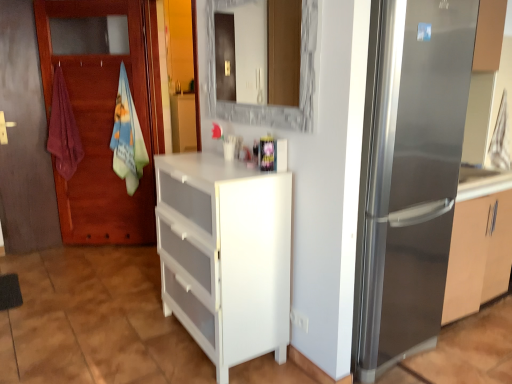
What do you see at coordinates (409, 175) in the screenshot?
I see `satin silver refrigerator at right` at bounding box center [409, 175].

Find the location of a particular element. This screenshot has width=512, height=384. light blue cotton beach towel at left, the second beach towel in the left-to-right sequence is located at coordinates (127, 137).

Describe the element at coordinates (63, 130) in the screenshot. I see `maroon cotton towel at left, positioned as the second beach towel in right-to-left order` at that location.

In order to click on wooden door at left in this screenshot , I will do `click(105, 122)`.

Where is `satin silver refrigerator at right`? satin silver refrigerator at right is located at coordinates (409, 175).

Is the depth of wooden door at left greater than that of satin silver refrigerator at right?

Yes, it is behind satin silver refrigerator at right.

Considering the sizes of wooden door at left and satin silver refrigerator at right in the image, is wooden door at left taller or shorter than satin silver refrigerator at right?

Considering their sizes, wooden door at left has more height than satin silver refrigerator at right.

Does point (102, 139) appear closer or farther from the camera than point (455, 181)?

Point (102, 139).

How much distance is there between wooden door at left and satin silver refrigerator at right?

They are 7.65 feet apart.

From the image's perspective, between light blue cotton beach towel at left, the second beach towel in the left-to-right sequence, and white plastic chest of drawers at center, which one is located above?

light blue cotton beach towel at left, the second beach towel in the left-to-right sequence, is shown above in the image.

Looking at their sizes, would you say light blue cotton beach towel at left, the second beach towel in the left-to-right sequence, is wider or thinner than white plastic chest of drawers at center?

Considering their sizes, light blue cotton beach towel at left, the second beach towel in the left-to-right sequence, looks slimmer than white plastic chest of drawers at center.

Do you think light blue cotton beach towel at left, which is counted as the 1th beach towel, starting from the right, is within white plastic chest of drawers at center, or outside of it?

A: light blue cotton beach towel at left, which is counted as the 1th beach towel, starting from the right, is located beyond the bounds of white plastic chest of drawers at center.

Is light blue cotton beach towel at left, the second beach towel in the left-to-right sequence, shorter than white plastic chest of drawers at center?

No, light blue cotton beach towel at left, the second beach towel in the left-to-right sequence, is not shorter than white plastic chest of drawers at center.

Is light blue cotton beach towel at left, which is counted as the 1th beach towel, starting from the right, wider or thinner than wooden door at left?

In the image, light blue cotton beach towel at left, which is counted as the 1th beach towel, starting from the right, appears to be wider than wooden door at left.

Considering the relative sizes of light blue cotton beach towel at left, which is counted as the 1th beach towel, starting from the right, and wooden door at left in the image provided, is light blue cotton beach towel at left, which is counted as the 1th beach towel, starting from the right, taller than wooden door at left?

Incorrect, the height of light blue cotton beach towel at left, which is counted as the 1th beach towel, starting from the right, is not larger of that of wooden door at left.

Considering the positions of objects light blue cotton beach towel at left, the second beach towel in the left-to-right sequence, and wooden door at left in the image provided, who is more to the left, light blue cotton beach towel at left, the second beach towel in the left-to-right sequence, or wooden door at left?

Positioned to the left is wooden door at left.

You are a GUI agent. You are given a task and a screenshot of the screen. Output one action in this format:
    pyautogui.click(x=<x>, y=<y>)
    Task: Click on the door above the maroon cotton towel at left, positioned as the first beach towel in left-to-right order (from a real-world perspective)
    This screenshot has width=512, height=384.
    Given the screenshot: What is the action you would take?
    pyautogui.click(x=105, y=122)

Based on the photo, does wooden door at left turn towards maroon cotton towel at left, positioned as the first beach towel in left-to-right order?

Yes, wooden door at left is oriented towards maroon cotton towel at left, positioned as the first beach towel in left-to-right order.

Consider the image. From a real-world perspective, which is physically above, wooden door at left or maroon cotton towel at left, positioned as the second beach towel in right-to-left order?

In real-world perspective, wooden door at left is above.

Can you confirm if wooden door at left is thinner than maroon cotton towel at left, positioned as the first beach towel in left-to-right order?

Yes, wooden door at left is thinner than maroon cotton towel at left, positioned as the first beach towel in left-to-right order.

From a real-world perspective, between wooden door at left and white plastic chest of drawers at center, who is vertically higher?

wooden door at left is physically above.

Looking at the image, does wooden door at left seem bigger or smaller compared to white plastic chest of drawers at center?

Considering their sizes, wooden door at left takes up less space than white plastic chest of drawers at center.

Considering the relative positions of wooden door at left and white plastic chest of drawers at center in the image provided, is wooden door at left to the left or to the right of white plastic chest of drawers at center?

wooden door at left is to the left of white plastic chest of drawers at center.

Based on the photo, considering the sizes of objects light blue cotton beach towel at left, the second beach towel in the left-to-right sequence, and maroon cotton towel at left, positioned as the second beach towel in right-to-left order, in the image provided, who is thinner, light blue cotton beach towel at left, the second beach towel in the left-to-right sequence, or maroon cotton towel at left, positioned as the second beach towel in right-to-left order,?

With smaller width is maroon cotton towel at left, positioned as the second beach towel in right-to-left order.

What's the angular difference between light blue cotton beach towel at left, which is counted as the 1th beach towel, starting from the right, and maroon cotton towel at left, positioned as the first beach towel in left-to-right order,'s facing directions?

The angle between the facing direction of light blue cotton beach towel at left, which is counted as the 1th beach towel, starting from the right, and the facing direction of maroon cotton towel at left, positioned as the first beach towel in left-to-right order, is 4.79e-05 degrees.

Considering the sizes of light blue cotton beach towel at left, which is counted as the 1th beach towel, starting from the right, and maroon cotton towel at left, positioned as the first beach towel in left-to-right order, in the image, is light blue cotton beach towel at left, which is counted as the 1th beach towel, starting from the right, bigger or smaller than maroon cotton towel at left, positioned as the first beach towel in left-to-right order,?

light blue cotton beach towel at left, which is counted as the 1th beach towel, starting from the right, is bigger than maroon cotton towel at left, positioned as the first beach towel in left-to-right order.

In the image, is light blue cotton beach towel at left, which is counted as the 1th beach towel, starting from the right, positioned in front of or behind maroon cotton towel at left, positioned as the second beach towel in right-to-left order?

light blue cotton beach towel at left, which is counted as the 1th beach towel, starting from the right, is positioned closer to the viewer than maroon cotton towel at left, positioned as the second beach towel in right-to-left order.

From a real-world perspective, is satin silver refrigerator at right above or below white plastic chest of drawers at center?

Clearly, from a real-world perspective, satin silver refrigerator at right is above white plastic chest of drawers at center.

Considering the relative positions of satin silver refrigerator at right and white plastic chest of drawers at center in the image provided, is satin silver refrigerator at right to the left or to the right of white plastic chest of drawers at center?

satin silver refrigerator at right is to the right of white plastic chest of drawers at center.

Consider the image. From the image's perspective, between satin silver refrigerator at right and white plastic chest of drawers at center, who is located below?

white plastic chest of drawers at center appears lower in the image.

Considering the sizes of objects satin silver refrigerator at right and white plastic chest of drawers at center in the image provided, who is shorter, satin silver refrigerator at right or white plastic chest of drawers at center?

white plastic chest of drawers at center is shorter.

You are a GUI agent. You are given a task and a screenshot of the screen. Output one action in this format:
    pyautogui.click(x=<x>, y=<y>)
    Task: Click on the refrigerator lying on the right of wooden door at left
    The image size is (512, 384).
    Given the screenshot: What is the action you would take?
    pyautogui.click(x=409, y=175)

I want to click on chest of drawers below the light blue cotton beach towel at left, the second beach towel in the left-to-right sequence (from the image's perspective), so click(x=225, y=255).

Based on their spatial positions, is maroon cotton towel at left, positioned as the second beach towel in right-to-left order, or satin silver refrigerator at right further from light blue cotton beach towel at left, the second beach towel in the left-to-right sequence?

The object further to light blue cotton beach towel at left, the second beach towel in the left-to-right sequence, is satin silver refrigerator at right.

Based on their spatial positions, is satin silver refrigerator at right or wooden door at left closer to light blue cotton beach towel at left, which is counted as the 1th beach towel, starting from the right?

Based on the image, wooden door at left appears to be nearer to light blue cotton beach towel at left, which is counted as the 1th beach towel, starting from the right.

When comparing their distances from wooden door at left, does satin silver refrigerator at right or maroon cotton towel at left, positioned as the second beach towel in right-to-left order, seem closer?

The object closer to wooden door at left is maroon cotton towel at left, positioned as the second beach towel in right-to-left order.

Which object lies nearer to the anchor point light blue cotton beach towel at left, the second beach towel in the left-to-right sequence, wooden door at left or maroon cotton towel at left, positioned as the first beach towel in left-to-right order?

Among the two, wooden door at left is located nearer to light blue cotton beach towel at left, the second beach towel in the left-to-right sequence.

In the scene shown: Looking at the image, which one is located closer to maroon cotton towel at left, positioned as the first beach towel in left-to-right order, light blue cotton beach towel at left, the second beach towel in the left-to-right sequence, or wooden door at left?

The object closer to maroon cotton towel at left, positioned as the first beach towel in left-to-right order, is wooden door at left.

Considering their positions, is satin silver refrigerator at right positioned further to light blue cotton beach towel at left, the second beach towel in the left-to-right sequence, than maroon cotton towel at left, positioned as the first beach towel in left-to-right order?

satin silver refrigerator at right is positioned further to the anchor light blue cotton beach towel at left, the second beach towel in the left-to-right sequence.

When comparing their distances from white plastic chest of drawers at center, does light blue cotton beach towel at left, which is counted as the 1th beach towel, starting from the right, or maroon cotton towel at left, positioned as the first beach towel in left-to-right order, seem further?

Among the two, maroon cotton towel at left, positioned as the first beach towel in left-to-right order, is located further to white plastic chest of drawers at center.

Estimate the real-world distances between objects in this image. Which object is further from satin silver refrigerator at right, maroon cotton towel at left, positioned as the first beach towel in left-to-right order, or light blue cotton beach towel at left, which is counted as the 1th beach towel, starting from the right?

maroon cotton towel at left, positioned as the first beach towel in left-to-right order.

Locate an element on the screen. The height and width of the screenshot is (384, 512). door located between white plastic chest of drawers at center and light blue cotton beach towel at left, the second beach towel in the left-to-right sequence, in the depth direction is located at coordinates (105, 122).

This screenshot has height=384, width=512. I want to click on the chest of drawers located between satin silver refrigerator at right and light blue cotton beach towel at left, the second beach towel in the left-to-right sequence, in the depth direction, so [x=225, y=255].

Locate an element on the screen. beach towel located between maroon cotton towel at left, positioned as the second beach towel in right-to-left order, and satin silver refrigerator at right in the left-right direction is located at coordinates (127, 137).

Image resolution: width=512 pixels, height=384 pixels. What are the coordinates of `beach towel positioned between white plastic chest of drawers at center and maroon cotton towel at left, positioned as the second beach towel in right-to-left order, from near to far` in the screenshot? It's located at (127, 137).